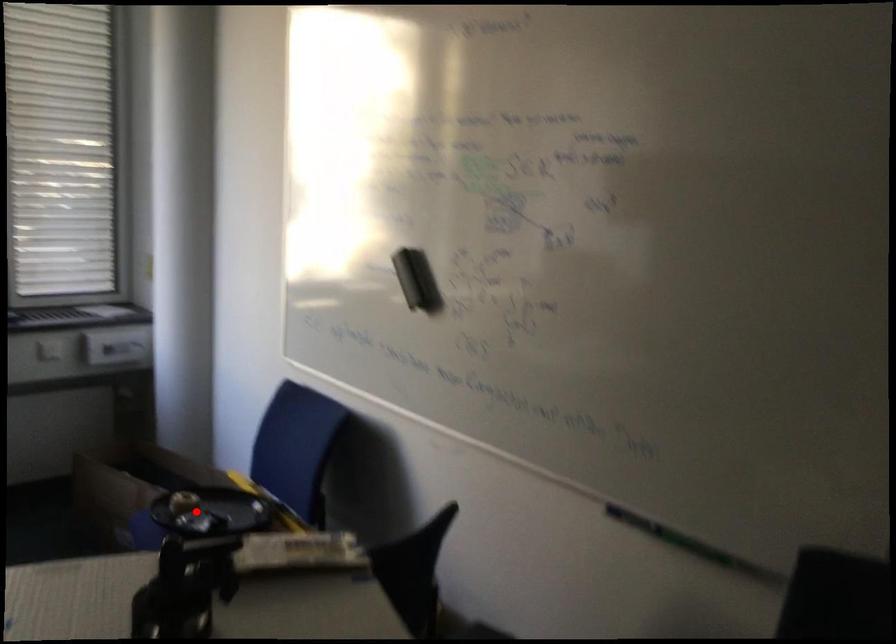
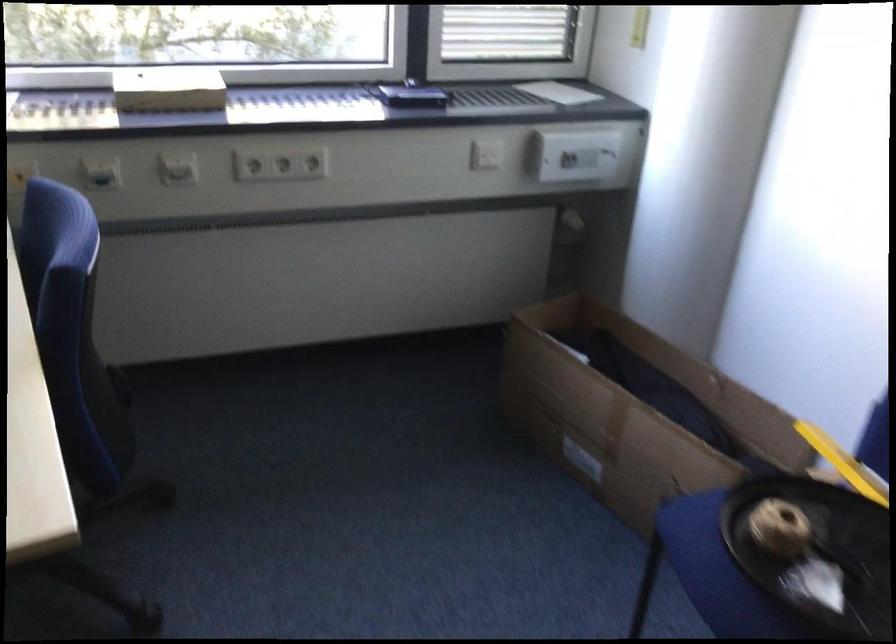
Find the pixel in the second image that matches the highlighted location in the first image.

(813, 552)